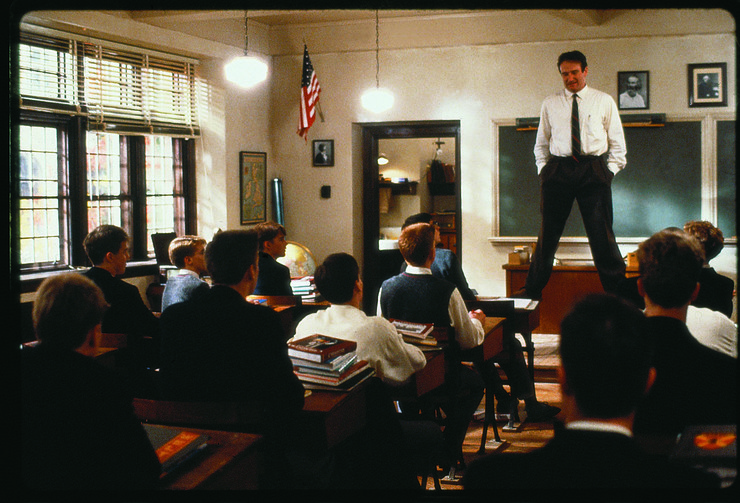
Where is `brown classroom floor`? Image resolution: width=740 pixels, height=503 pixels. brown classroom floor is located at coordinates (519, 438), (440, 488), (541, 388), (541, 353).